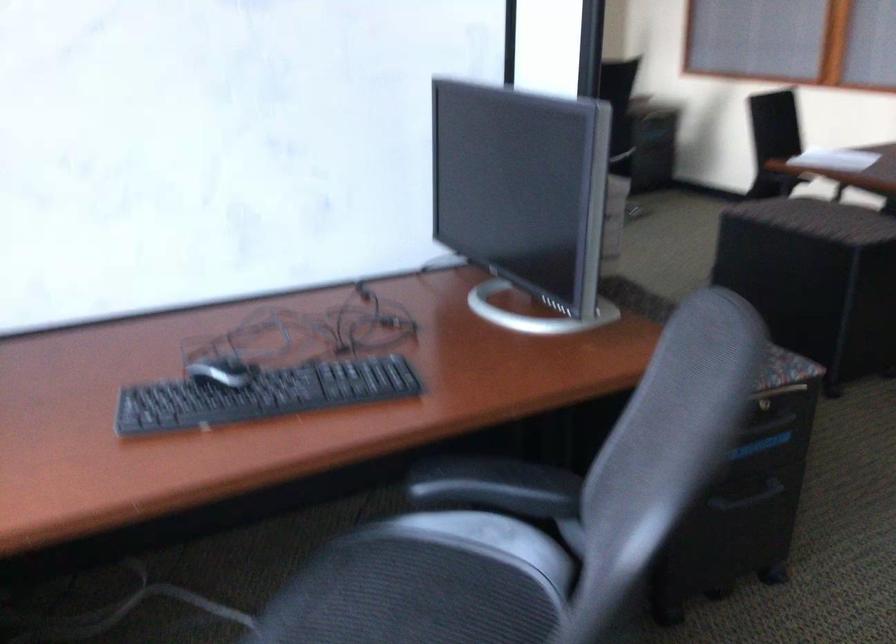
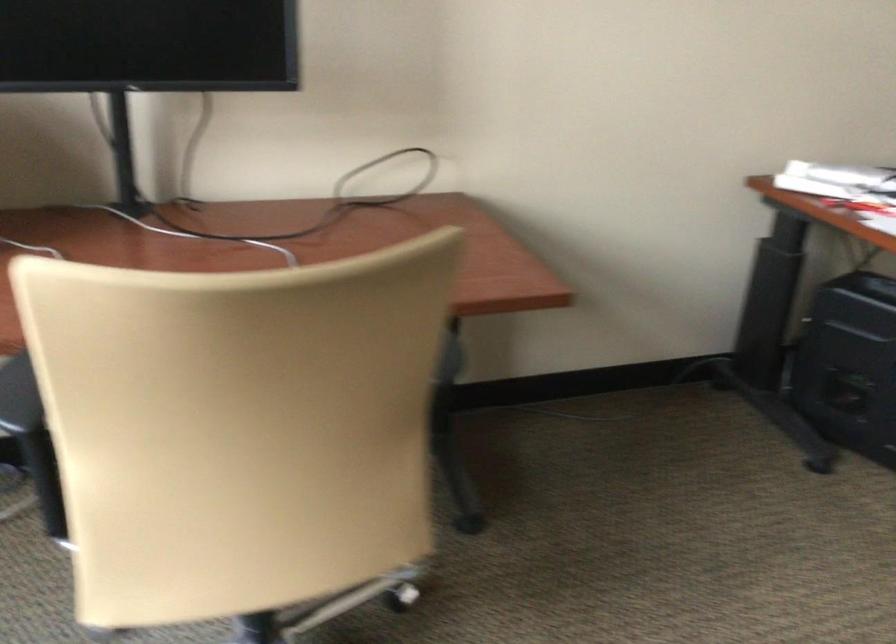
Question: What movement of the cameraman would produce the second image?

Choices:
 (A) Left
 (B) Right
 (C) Forward
 (D) Backward

Answer: (C)